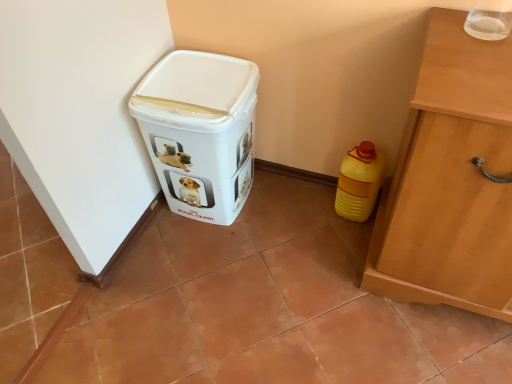
This screenshot has width=512, height=384. I want to click on vacant area that is situated to the right of white plastic container at lower left, so click(294, 211).